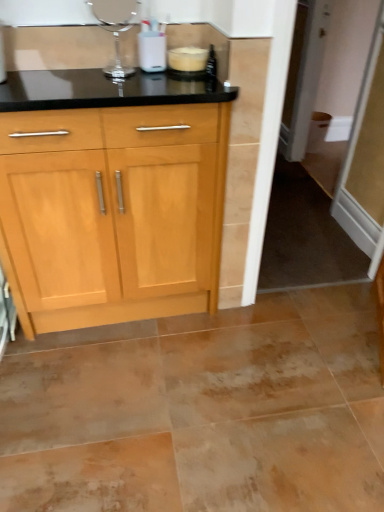
What do you see at coordinates (327, 214) in the screenshot? This screenshot has height=512, width=384. I see `transparent glass screen door at right` at bounding box center [327, 214].

Describe the element at coordinates (115, 29) in the screenshot. I see `clear glass vase at upper center, marked as the 1th appliance in a left-to-right arrangement` at that location.

Identify the location of transparent glass screen door at right. (327, 214).

From the image's perspective, between transparent glass screen door at right and clear glass vase at upper center, the 2th appliance in the right-to-left sequence, which one is located above?

transparent glass screen door at right, from the image's perspective.

From a real-world perspective, is transparent glass screen door at right located beneath clear glass vase at upper center, marked as the 1th appliance in a left-to-right arrangement?

Yes.

Is transparent glass screen door at right aimed at clear glass vase at upper center, marked as the 1th appliance in a left-to-right arrangement?

No, transparent glass screen door at right is not turned towards clear glass vase at upper center, marked as the 1th appliance in a left-to-right arrangement.

From the image's perspective, would you say white plastic container at upper center, the first appliance from the right, is shown under clear glass vase at upper center, marked as the 1th appliance in a left-to-right arrangement?

Yes.

Which of these two, white plastic container at upper center, the first appliance from the right, or clear glass vase at upper center, marked as the 1th appliance in a left-to-right arrangement, stands shorter?

white plastic container at upper center, the first appliance from the right, is shorter.

From a real-world perspective, is white plastic container at upper center, arranged as the second appliance when viewed from the left, beneath clear glass vase at upper center, the 2th appliance in the right-to-left sequence?

Yes, from a real-world perspective, white plastic container at upper center, arranged as the second appliance when viewed from the left, is under clear glass vase at upper center, the 2th appliance in the right-to-left sequence.

Is white plastic container at upper center, the first appliance from the right, positioned before clear glass vase at upper center, the 2th appliance in the right-to-left sequence?

No, the depth of white plastic container at upper center, the first appliance from the right, is greater than that of clear glass vase at upper center, the 2th appliance in the right-to-left sequence.

Which point is more distant from viewer, (285, 165) or (194, 56)?

The point (285, 165) is more distant.

Identify the location of the 2nd appliance positioned below the transparent glass screen door at right (from the image's perspective). Image resolution: width=384 pixels, height=512 pixels. (192, 63).

From the image's perspective, does transparent glass screen door at right appear higher than white plastic container at upper center, the first appliance from the right?

Correct, transparent glass screen door at right appears higher than white plastic container at upper center, the first appliance from the right, in the image.

Which object is positioned more to the right, transparent glass screen door at right or white plastic container at upper center, arranged as the second appliance when viewed from the left?

transparent glass screen door at right.

Which is in front, clear glass vase at upper center, the 2th appliance in the right-to-left sequence, or transparent glass screen door at right?

clear glass vase at upper center, the 2th appliance in the right-to-left sequence.

Is clear glass vase at upper center, the 2th appliance in the right-to-left sequence, inside or outside of transparent glass screen door at right?

clear glass vase at upper center, the 2th appliance in the right-to-left sequence, cannot be found inside transparent glass screen door at right.

From the image's perspective, is clear glass vase at upper center, the 2th appliance in the right-to-left sequence, located above or below transparent glass screen door at right?

clear glass vase at upper center, the 2th appliance in the right-to-left sequence, is situated lower than transparent glass screen door at right in the image.

Can you confirm if clear glass vase at upper center, marked as the 1th appliance in a left-to-right arrangement, is wider than transparent glass screen door at right?

Incorrect, the width of clear glass vase at upper center, marked as the 1th appliance in a left-to-right arrangement, does not surpass that of transparent glass screen door at right.

Consider the image. Is clear glass vase at upper center, the 2th appliance in the right-to-left sequence, closer to camera compared to white plastic container at upper center, arranged as the second appliance when viewed from the left?

Yes, clear glass vase at upper center, the 2th appliance in the right-to-left sequence, is closer to the camera.

From a real-world perspective, is clear glass vase at upper center, the 2th appliance in the right-to-left sequence, below white plastic container at upper center, the first appliance from the right?

No, from a real-world perspective, clear glass vase at upper center, the 2th appliance in the right-to-left sequence, is not under white plastic container at upper center, the first appliance from the right.

Which of these two, clear glass vase at upper center, the 2th appliance in the right-to-left sequence, or white plastic container at upper center, the first appliance from the right, stands shorter?

white plastic container at upper center, the first appliance from the right, is shorter.

Is white plastic container at upper center, arranged as the second appliance when viewed from the left, positioned far away from transparent glass screen door at right?

Absolutely, white plastic container at upper center, arranged as the second appliance when viewed from the left, is distant from transparent glass screen door at right.

Looking at this image, does white plastic container at upper center, arranged as the second appliance when viewed from the left, appear on the right side of transparent glass screen door at right?

No.

Considering their positions, is white plastic container at upper center, arranged as the second appliance when viewed from the left, located in front of or behind transparent glass screen door at right?

In the image, white plastic container at upper center, arranged as the second appliance when viewed from the left, appears in front of transparent glass screen door at right.

Based on the photo, is white plastic container at upper center, the first appliance from the right, taller than transparent glass screen door at right?

No.

From the transparent glass screen door at right, count 2nd appliances forward and point to it. Please provide its 2D coordinates.

[(115, 29)]

At what (x,y) coordinates should I click in order to perform the action: click on appliance above the white plastic container at upper center, the first appliance from the right (from a real-world perspective). Please return your answer as a coordinate pair (x, y). Looking at the image, I should click on (115, 29).

Looking at the image, which one is located further to clear glass vase at upper center, the 2th appliance in the right-to-left sequence, transparent glass screen door at right or white plastic container at upper center, arranged as the second appliance when viewed from the left?

transparent glass screen door at right.

Looking at the image, which one is located further to white plastic container at upper center, arranged as the second appliance when viewed from the left, transparent glass screen door at right or clear glass vase at upper center, the 2th appliance in the right-to-left sequence?

transparent glass screen door at right lies further to white plastic container at upper center, arranged as the second appliance when viewed from the left, than the other object.

From the image, which object appears to be nearer to white plastic container at upper center, the first appliance from the right, clear glass vase at upper center, the 2th appliance in the right-to-left sequence, or transparent glass screen door at right?

Based on the image, clear glass vase at upper center, the 2th appliance in the right-to-left sequence, appears to be nearer to white plastic container at upper center, the first appliance from the right.

Looking at the image, which one is located further to clear glass vase at upper center, the 2th appliance in the right-to-left sequence, white plastic container at upper center, arranged as the second appliance when viewed from the left, or transparent glass screen door at right?

transparent glass screen door at right.

From the image, which object appears to be nearer to transparent glass screen door at right, clear glass vase at upper center, marked as the 1th appliance in a left-to-right arrangement, or white plastic container at upper center, arranged as the second appliance when viewed from the left?

white plastic container at upper center, arranged as the second appliance when viewed from the left, lies closer to transparent glass screen door at right than the other object.

When comparing their distances from transparent glass screen door at right, does white plastic container at upper center, the first appliance from the right, or clear glass vase at upper center, the 2th appliance in the right-to-left sequence, seem further?

Based on the image, clear glass vase at upper center, the 2th appliance in the right-to-left sequence, appears to be further to transparent glass screen door at right.

Image resolution: width=384 pixels, height=512 pixels. Identify the location of appliance between clear glass vase at upper center, marked as the 1th appliance in a left-to-right arrangement, and transparent glass screen door at right from left to right. (192, 63).